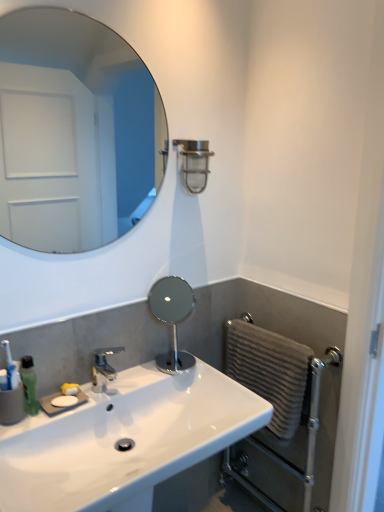
Question: Is polished silver mirror at center, acting as the 2th mirror starting from the top, surrounding silver metallic faucet at center?

Choices:
 (A) yes
 (B) no

Answer: (B)

Question: Does polished silver mirror at center, acting as the 2th mirror starting from the top, have a smaller size compared to silver metallic faucet at center?

Choices:
 (A) no
 (B) yes

Answer: (A)

Question: Is polished silver mirror at center, acting as the 2th mirror starting from the top, taller than silver metallic faucet at center?

Choices:
 (A) yes
 (B) no

Answer: (A)

Question: Considering the relative sizes of polished silver mirror at center, positioned as the first mirror in bottom-to-top order, and silver metallic faucet at center in the image provided, is polished silver mirror at center, positioned as the first mirror in bottom-to-top order, thinner than silver metallic faucet at center?

Choices:
 (A) yes
 (B) no

Answer: (A)

Question: Can you confirm if polished silver mirror at center, positioned as the first mirror in bottom-to-top order, is positioned to the right of silver metallic faucet at center?

Choices:
 (A) no
 (B) yes

Answer: (B)

Question: Is polished silver mirror at center, acting as the 2th mirror starting from the top, far away from silver metallic faucet at center?

Choices:
 (A) no
 (B) yes

Answer: (A)

Question: Considering the relative positions of polished silver mirror at center, acting as the 2th mirror starting from the top, and white glossy sink at lower left in the image provided, is polished silver mirror at center, acting as the 2th mirror starting from the top, in front of white glossy sink at lower left?

Choices:
 (A) no
 (B) yes

Answer: (A)

Question: From a real-world perspective, is polished silver mirror at center, positioned as the first mirror in bottom-to-top order, physically below white glossy sink at lower left?

Choices:
 (A) no
 (B) yes

Answer: (A)

Question: Considering the relative sizes of polished silver mirror at center, acting as the 2th mirror starting from the top, and white glossy sink at lower left in the image provided, is polished silver mirror at center, acting as the 2th mirror starting from the top, bigger than white glossy sink at lower left?

Choices:
 (A) yes
 (B) no

Answer: (B)

Question: Is polished silver mirror at center, positioned as the first mirror in bottom-to-top order, shorter than white glossy sink at lower left?

Choices:
 (A) yes
 (B) no

Answer: (B)

Question: Is polished silver mirror at center, positioned as the first mirror in bottom-to-top order, not within white glossy sink at lower left?

Choices:
 (A) no
 (B) yes

Answer: (B)

Question: Is polished silver mirror at center, positioned as the first mirror in bottom-to-top order, wider than white glossy sink at lower left?

Choices:
 (A) yes
 (B) no

Answer: (B)

Question: Would you consider gray textured towel at right to be distant from satin nickel shower at upper center?

Choices:
 (A) yes
 (B) no

Answer: (B)